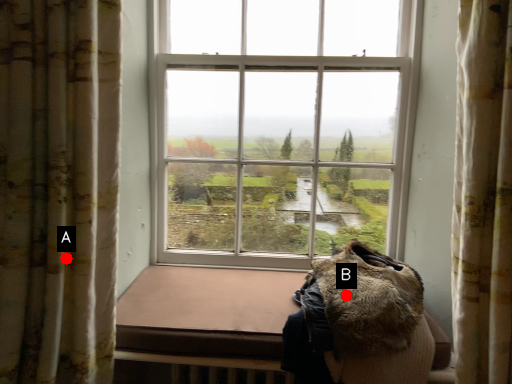
Question: Two points are circled on the image, labeled by A and B beside each circle. Which point appears closest to the camera in this image?

Choices:
 (A) A is closer
 (B) B is closer

Answer: (A)